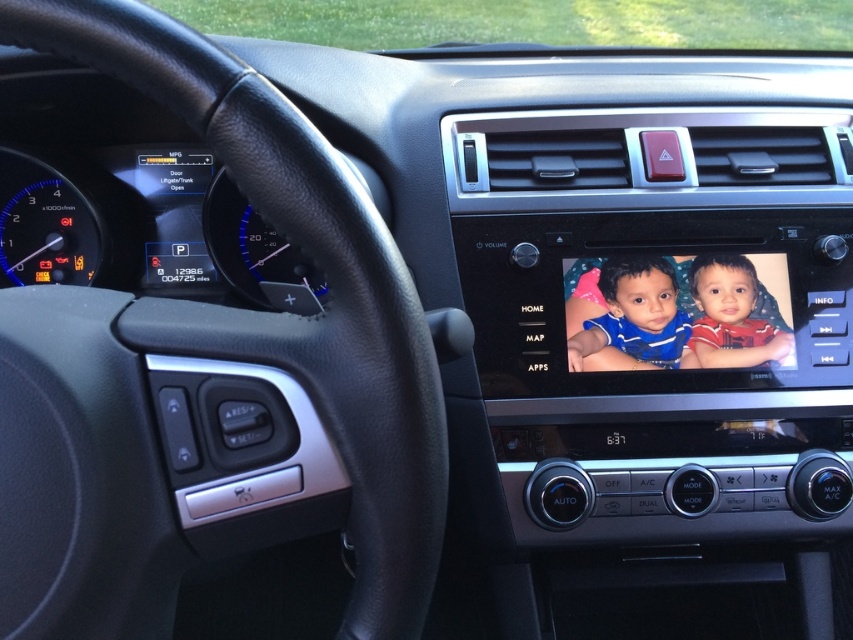
Who is shorter, blue fabric baby at center or matte red shirt at center?

With less height is matte red shirt at center.

Is blue fabric baby at center thinner than matte red shirt at center?

Incorrect, blue fabric baby at center's width is not less than matte red shirt at center's.

Who is more distant from viewer, [653,346] or [724,289]?

The point [724,289] is more distant.

You are a GUI agent. You are given a task and a screenshot of the screen. Output one action in this format:
    pyautogui.click(x=<x>, y=<y>)
    Task: Click on the blue fabric baby at center
    This screenshot has height=640, width=853.
    Given the screenshot: What is the action you would take?
    pyautogui.click(x=636, y=316)